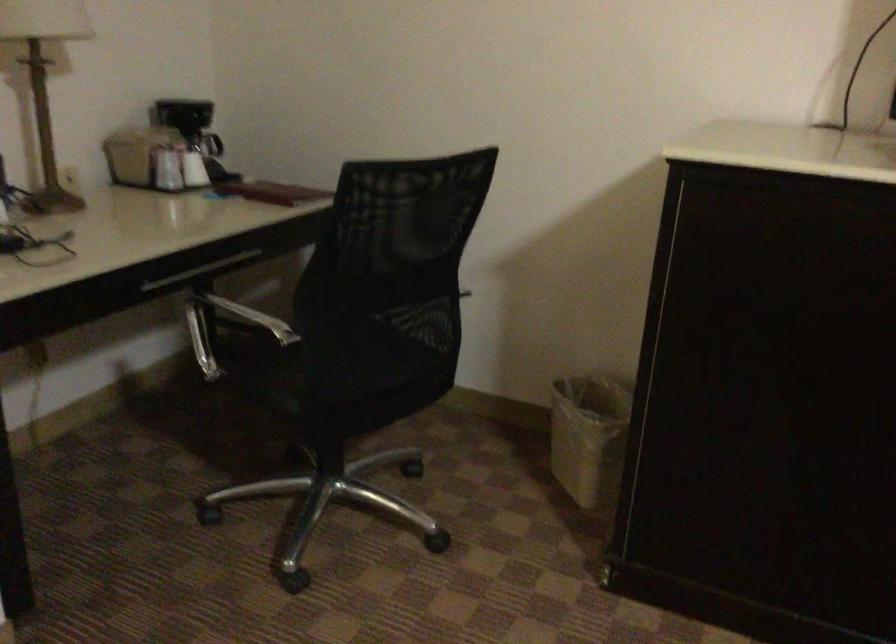
Where is `chair sitting surface`? The image size is (896, 644). chair sitting surface is located at coordinates (263, 359).